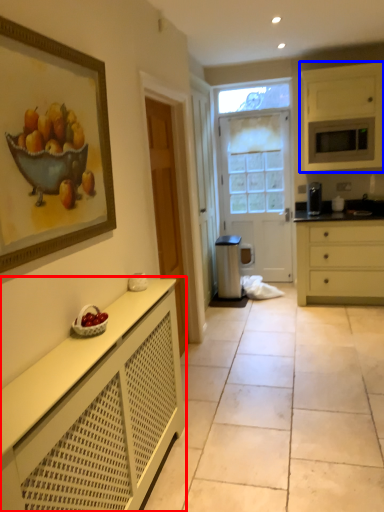
Question: Which object is closer to the camera taking this photo, cabinetry (highlighted by a red box) or cabinetry (highlighted by a blue box)?

Choices:
 (A) cabinetry
 (B) cabinetry

Answer: (A)